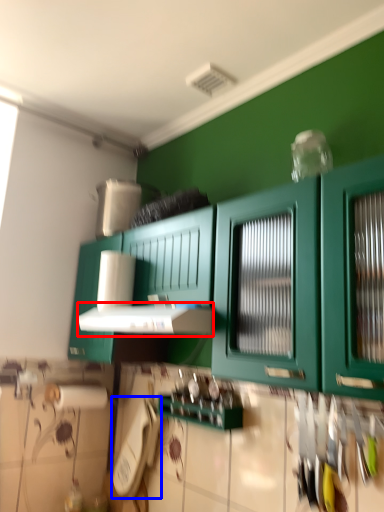
Question: Which point is further to the camera, vent (highlighted by a red box) or appliance (highlighted by a blue box)?

Choices:
 (A) vent
 (B) appliance

Answer: (B)